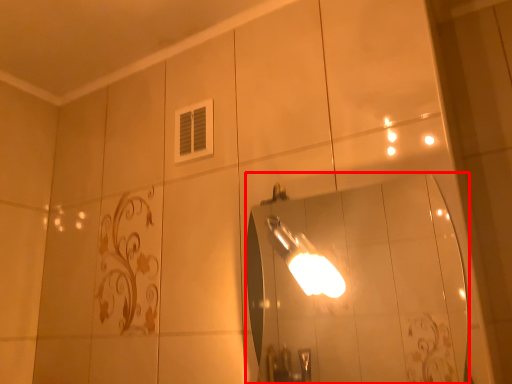
Question: From the image's perspective, considering the relative positions of mirror (annotated by the red box) and light fixture in the image provided, where is mirror (annotated by the red box) located with respect to the staircase?

Choices:
 (A) below
 (B) above

Answer: (A)